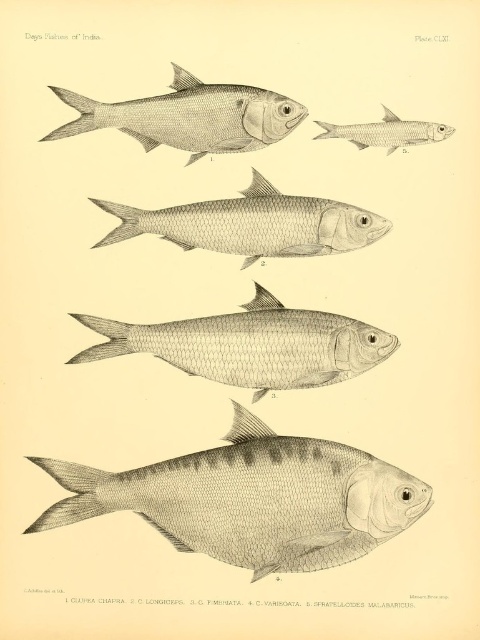
Question: Which of the following is the farthest from the observer?

Choices:
 (A) smooth silver fish at center
 (B) gray metallic fish at upper center

Answer: (A)

Question: Which object is positioned farthest from the gray textured fish at upper center?

Choices:
 (A) smooth silver fish at center
 (B) grayish silver fish at upper center
 (C) gray textured fish at bottom

Answer: (C)

Question: Does gray textured fish at bottom appear under gray metallic fish at upper center?

Choices:
 (A) no
 (B) yes

Answer: (B)

Question: In this image, where is grayish silver fish at upper center located relative to gray textured fish at upper center?

Choices:
 (A) left
 (B) right

Answer: (B)

Question: Is grayish silver fish at center thinner than gray metallic fish at upper center?

Choices:
 (A) no
 (B) yes

Answer: (A)

Question: Which of these objects is positioned closest to the grayish silver fish at upper center?

Choices:
 (A) gray textured fish at upper center
 (B) smooth silver fish at center
 (C) gray metallic fish at upper center

Answer: (B)